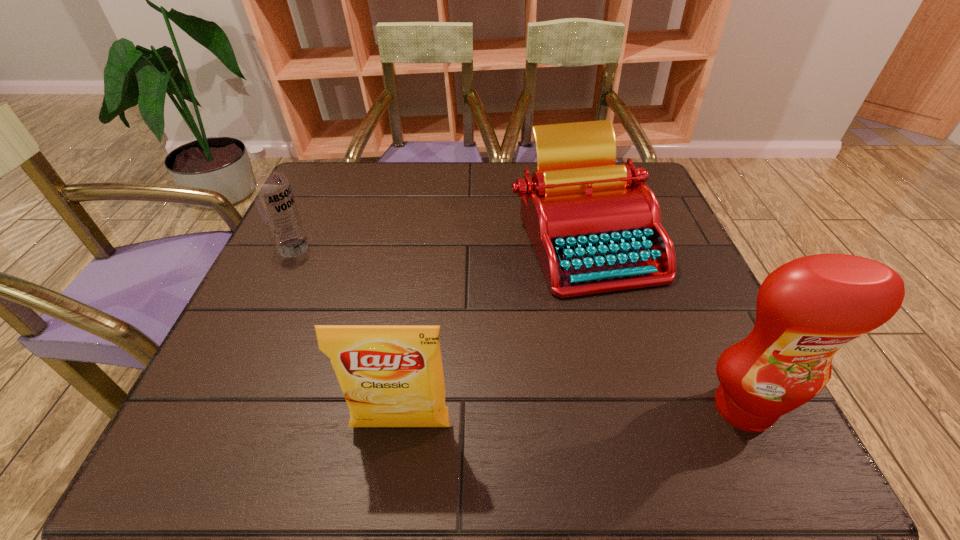
You are a GUI agent. You are given a task and a screenshot of the screen. Output one action in this format:
    pyautogui.click(x=<x>, y=<y>)
    Task: Click on the third object from right to left
    The image size is (960, 540).
    Given the screenshot: What is the action you would take?
    pyautogui.click(x=391, y=375)

What are the coordinates of `condiment` in the screenshot? It's located at (807, 309).

The width and height of the screenshot is (960, 540). In order to click on the leftmost object in this screenshot , I will do `click(270, 188)`.

This screenshot has height=540, width=960. I want to click on typewriter, so click(595, 227).

Identify the location of free spot located 0.260m on the front label of the vodka. The width and height of the screenshot is (960, 540). (375, 309).

Find the location of a particular element. The height and width of the screenshot is (540, 960). vacant space located 0.050m on the front label of the vodka is located at coordinates (315, 264).

This screenshot has width=960, height=540. Identify the location of free space located on the front label of the vodka. (396, 323).

At what (x,y) coordinates should I click in order to perform the action: click on vacant space located 0.260m on the typing side of the shortest object. Please return your answer as a coordinate pair (x, y). Looking at the image, I should click on (544, 401).

Locate an element on the screen. The height and width of the screenshot is (540, 960). free spot located on the typing side of the shortest object is located at coordinates (562, 335).

Identify the location of free space located 0.210m on the typing side of the shortest object. This screenshot has width=960, height=540. (551, 377).